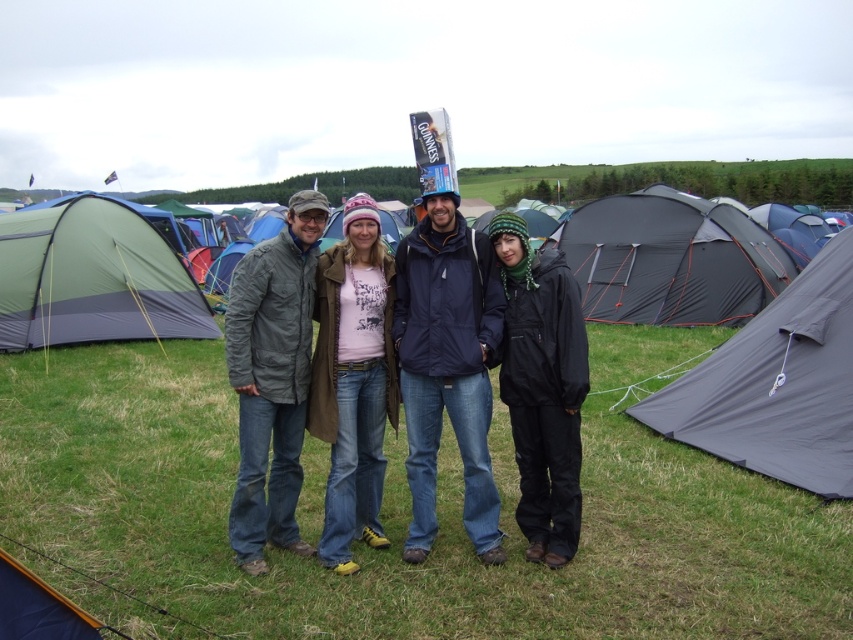
You are standing at the starting point and need to reach the destination point. The starting point is at point (322,316) and the destination is at point (525,522). Based on the coordinates given, which direction should you move to get from the starting point to the destination point?

To move from point (322,316) to point (525,522), you should move northeast since the destination point has a higher x and y coordinate than the starting point.